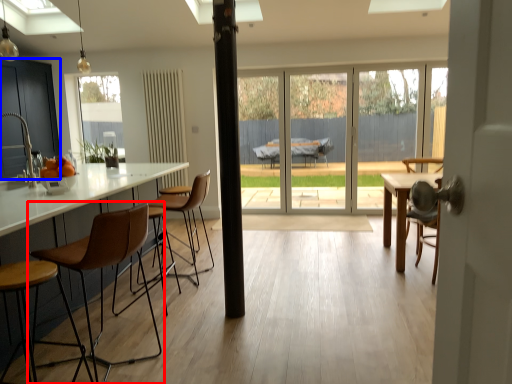
Question: Which of the following is the farthest to the observer, chair (highlighted by a red box) or cabinetry (highlighted by a blue box)?

Choices:
 (A) chair
 (B) cabinetry

Answer: (B)